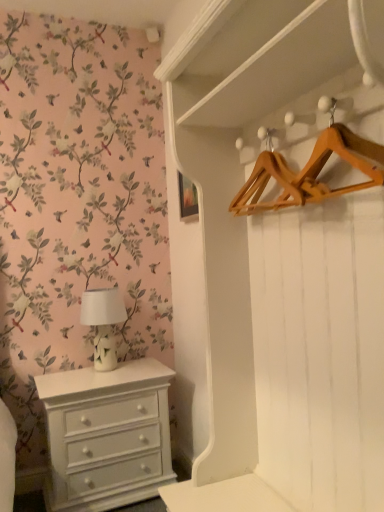
Question: Is white painted wood chest of drawers at lower left outside white glossy table lamp at left?

Choices:
 (A) yes
 (B) no

Answer: (A)

Question: Is white painted wood chest of drawers at lower left at the left side of white glossy table lamp at left?

Choices:
 (A) no
 (B) yes

Answer: (A)

Question: Considering the relative sizes of white painted wood chest of drawers at lower left and white glossy table lamp at left in the image provided, is white painted wood chest of drawers at lower left taller than white glossy table lamp at left?

Choices:
 (A) yes
 (B) no

Answer: (A)

Question: Can white glossy table lamp at left be found inside white painted wood chest of drawers at lower left?

Choices:
 (A) no
 (B) yes

Answer: (A)

Question: Can you confirm if white painted wood chest of drawers at lower left is smaller than white glossy table lamp at left?

Choices:
 (A) yes
 (B) no

Answer: (B)

Question: From a real-world perspective, is wooden hanger at upper right positioned above or below white glossy table lamp at left?

Choices:
 (A) above
 (B) below

Answer: (A)

Question: Does point (360, 157) appear closer or farther from the camera than point (107, 362)?

Choices:
 (A) farther
 (B) closer

Answer: (B)

Question: Is wooden hanger at upper right situated inside white glossy table lamp at left or outside?

Choices:
 (A) inside
 (B) outside

Answer: (B)

Question: Visually, is wooden hanger at upper right positioned to the left or to the right of white glossy table lamp at left?

Choices:
 (A) right
 (B) left

Answer: (A)

Question: Would you say white glossy table lamp at left is inside or outside wooden hanger at upper right?

Choices:
 (A) outside
 (B) inside

Answer: (A)

Question: Based on their sizes in the image, would you say white glossy table lamp at left is bigger or smaller than wooden hanger at upper right?

Choices:
 (A) big
 (B) small

Answer: (A)

Question: Is white glossy table lamp at left in front of or behind wooden hanger at upper right in the image?

Choices:
 (A) behind
 (B) front

Answer: (A)

Question: Is white glossy table lamp at left wider or thinner than wooden hanger at upper right?

Choices:
 (A) thin
 (B) wide

Answer: (B)

Question: From the image's perspective, is white glossy table lamp at left above or below white painted wood chest of drawers at lower left?

Choices:
 (A) below
 (B) above

Answer: (B)

Question: From their relative heights in the image, would you say white glossy table lamp at left is taller or shorter than white painted wood chest of drawers at lower left?

Choices:
 (A) short
 (B) tall

Answer: (A)